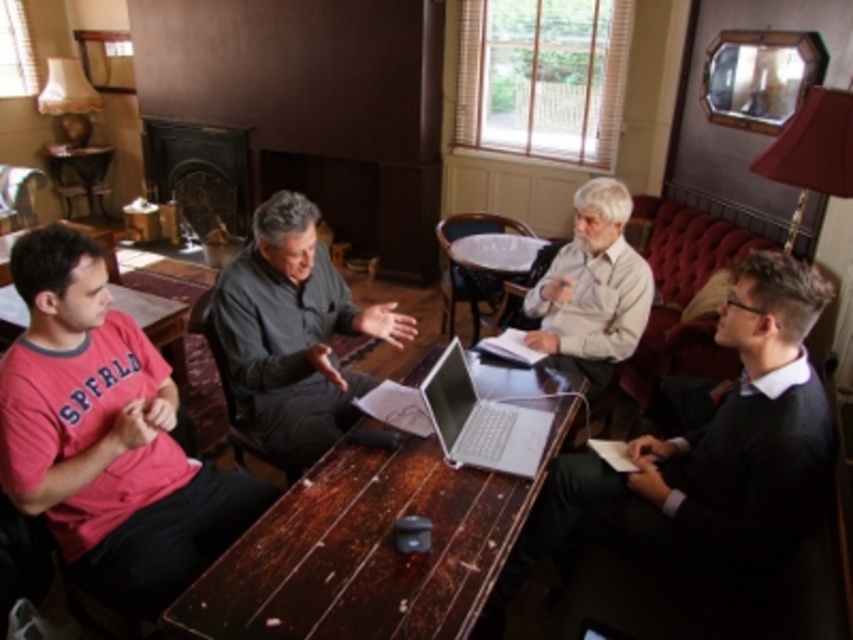
Looking at this image, you are a person who needs to place a 8 inch wide notebook on the table. Can you fit it between the wooden table at center and the silver metallic laptop at center?

The wooden table at center and silver metallic laptop at center are 7.75 inches apart, so the 8 inch wide notebook cannot fit between them as it is slightly wider than the available space.